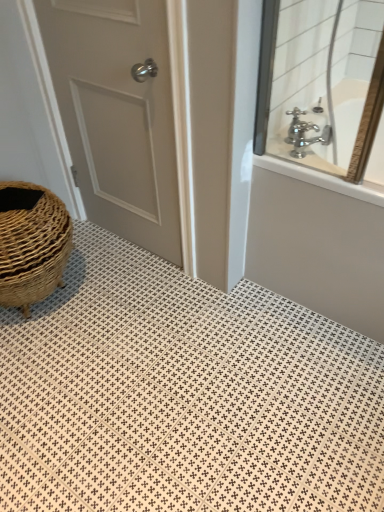
Question: From the image's perspective, would you say polished chrome faucet at upper right is positioned over white textured tile at lower left?

Choices:
 (A) no
 (B) yes

Answer: (B)

Question: Does polished chrome faucet at upper right appear on the left side of white textured tile at lower left?

Choices:
 (A) no
 (B) yes

Answer: (A)

Question: Is polished chrome faucet at upper right smaller than white textured tile at lower left?

Choices:
 (A) no
 (B) yes

Answer: (B)

Question: Considering the relative sizes of polished chrome faucet at upper right and white textured tile at lower left in the image provided, is polished chrome faucet at upper right thinner than white textured tile at lower left?

Choices:
 (A) no
 (B) yes

Answer: (B)

Question: Does polished chrome faucet at upper right have a greater width compared to white textured tile at lower left?

Choices:
 (A) no
 (B) yes

Answer: (A)

Question: From a real-world perspective, is silver metallic faucet at upper right positioned above or below white matte door at left?

Choices:
 (A) above
 (B) below

Answer: (A)

Question: Considering the positions of silver metallic faucet at upper right and white matte door at left in the image, is silver metallic faucet at upper right wider or thinner than white matte door at left?

Choices:
 (A) thin
 (B) wide

Answer: (B)

Question: In the image, is silver metallic faucet at upper right positioned in front of or behind white matte door at left?

Choices:
 (A) behind
 (B) front

Answer: (A)

Question: From the image's perspective, is silver metallic faucet at upper right located above or below white matte door at left?

Choices:
 (A) above
 (B) below

Answer: (B)

Question: Do you think white matte door at left is within white textured tile at lower left, or outside of it?

Choices:
 (A) outside
 (B) inside

Answer: (A)

Question: Considering the positions of point (102, 214) and point (349, 503), is point (102, 214) closer or farther from the camera than point (349, 503)?

Choices:
 (A) closer
 (B) farther

Answer: (B)

Question: From their relative heights in the image, would you say white matte door at left is taller or shorter than white textured tile at lower left?

Choices:
 (A) short
 (B) tall

Answer: (B)

Question: In the image, is white matte door at left positioned in front of or behind white textured tile at lower left?

Choices:
 (A) front
 (B) behind

Answer: (B)

Question: Is chrome metallic faucet at upper right taller or shorter than polished chrome faucet at upper right?

Choices:
 (A) tall
 (B) short

Answer: (B)

Question: Would you say chrome metallic faucet at upper right is to the left or to the right of polished chrome faucet at upper right in the picture?

Choices:
 (A) right
 (B) left

Answer: (B)